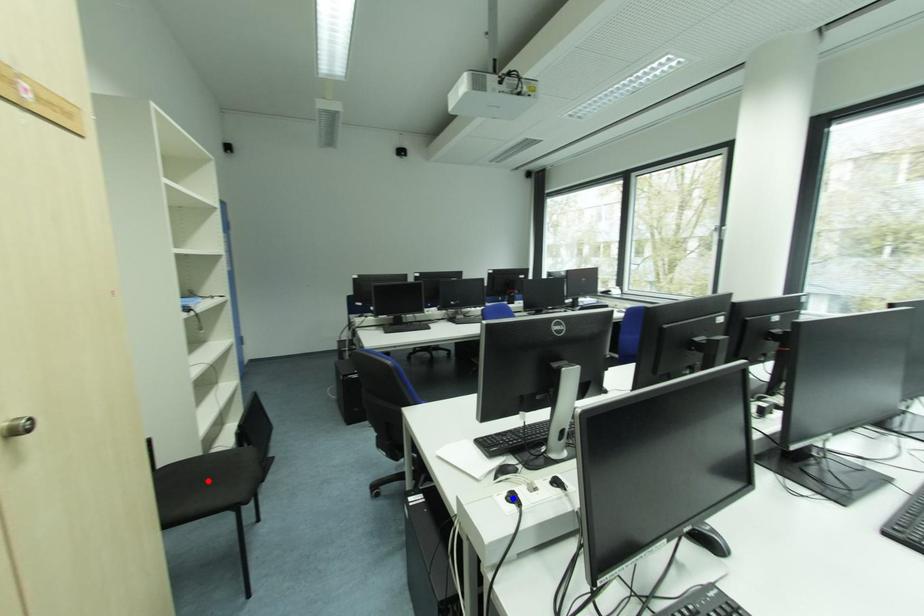
Question: Which of the two points in the image is closer to the camera?

Choices:
 (A) Blue point is closer.
 (B) Red point is closer.

Answer: (A)